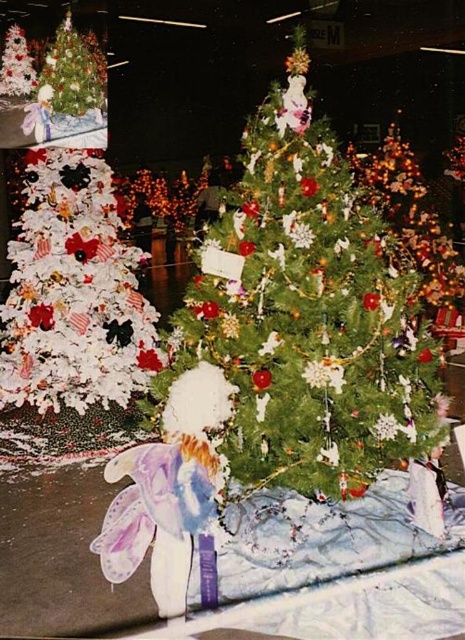
Question: Which point is farther to the camera?

Choices:
 (A) (410, 172)
 (B) (409, 312)
 (C) (13, 326)

Answer: (A)

Question: Can you confirm if green matte christmas tree at center is positioned above white matte christmas tree at left?

Choices:
 (A) no
 (B) yes

Answer: (A)

Question: Is green matte christmas tree at center closer to camera compared to white matte christmas tree at left?

Choices:
 (A) yes
 (B) no

Answer: (A)

Question: Can you confirm if green matte christmas tree at center is positioned to the right of white matte christmas tree at left?

Choices:
 (A) yes
 (B) no

Answer: (A)

Question: Which point is closer to the camera taking this photo?

Choices:
 (A) 357,307
 (B) 35,248

Answer: (A)

Question: Which object is positioned farthest from the green matte christmas tree at center?

Choices:
 (A) shiny gold ornaments at center
 (B) white matte christmas tree at left

Answer: (A)